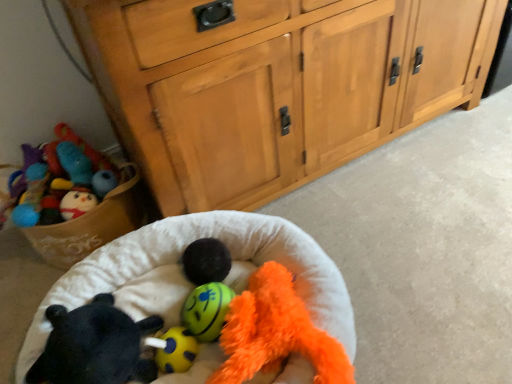
Question: From the image's perspective, is black fuzzy ball at center below yellow rubber ball at center, which is the 2th toy in left-to-right order?

Choices:
 (A) no
 (B) yes

Answer: (A)

Question: Is yellow rubber ball at center, which is the 2th toy in left-to-right order, at the back of black fuzzy ball at center?

Choices:
 (A) no
 (B) yes

Answer: (A)

Question: From a real-world perspective, does black fuzzy ball at center stand above yellow rubber ball at center, which is the 2th toy in left-to-right order?

Choices:
 (A) no
 (B) yes

Answer: (B)

Question: Is the surface of black fuzzy ball at center in direct contact with yellow rubber ball at center, which is the 2th toy in left-to-right order?

Choices:
 (A) yes
 (B) no

Answer: (B)

Question: Considering the relative sizes of black fuzzy ball at center and yellow rubber ball at center, which is the 2th toy in left-to-right order, in the image provided, is black fuzzy ball at center shorter than yellow rubber ball at center, which is the 2th toy in left-to-right order,?

Choices:
 (A) yes
 (B) no

Answer: (B)

Question: Visually, is soft plush infant bed at center positioned to the left or to the right of black plush bear at lower left, placed as the first toy when sorted from left to right?

Choices:
 (A) left
 (B) right

Answer: (B)

Question: Is soft plush infant bed at center bigger or smaller than black plush bear at lower left, positioned as the 4th toy in right-to-left order?

Choices:
 (A) small
 (B) big

Answer: (B)

Question: From their relative heights in the image, would you say soft plush infant bed at center is taller or shorter than black plush bear at lower left, placed as the first toy when sorted from left to right?

Choices:
 (A) tall
 (B) short

Answer: (A)

Question: Considering the positions of point (69, 271) and point (61, 379), is point (69, 271) closer or farther from the camera than point (61, 379)?

Choices:
 (A) closer
 (B) farther

Answer: (B)

Question: From the image's perspective, is yellow rubber ball at center, which is the 3th toy in left-to-right order, located above or below black fuzzy ball at center?

Choices:
 (A) below
 (B) above

Answer: (A)

Question: Is yellow rubber ball at center, which is the 3th toy in left-to-right order, in front of or behind black fuzzy ball at center in the image?

Choices:
 (A) behind
 (B) front

Answer: (B)

Question: Does point (198, 334) appear closer or farther from the camera than point (216, 243)?

Choices:
 (A) closer
 (B) farther

Answer: (A)

Question: Visually, is yellow rubber ball at center, arranged as the second toy when viewed from the right, positioned to the left or to the right of black fuzzy ball at center?

Choices:
 (A) right
 (B) left

Answer: (A)

Question: Looking at the image, does yellow rubber ball at center, which is the 2th toy in left-to-right order, seem bigger or smaller compared to black plush bear at lower left, positioned as the 4th toy in right-to-left order?

Choices:
 (A) big
 (B) small

Answer: (B)

Question: From the image's perspective, is yellow rubber ball at center, the third toy when ordered from right to left, located above or below black plush bear at lower left, positioned as the 4th toy in right-to-left order?

Choices:
 (A) below
 (B) above

Answer: (A)